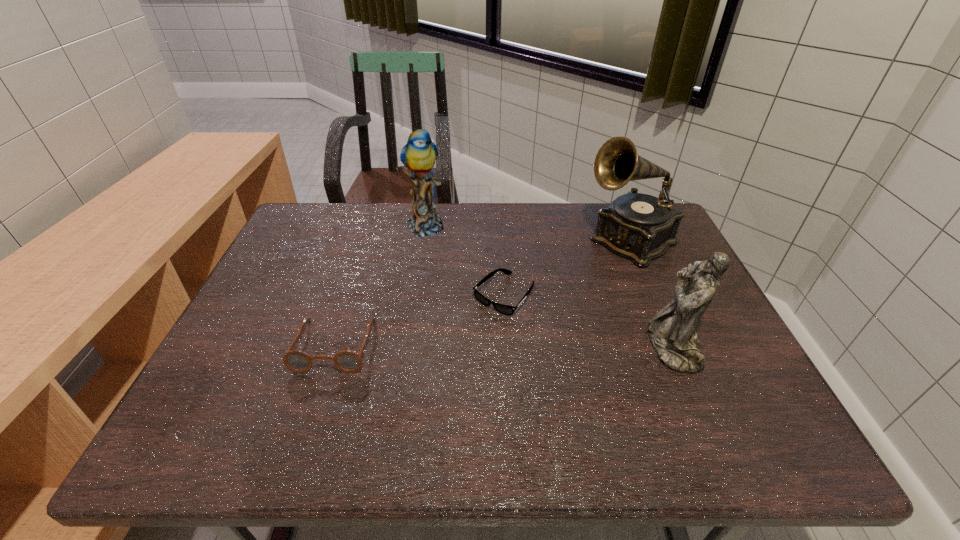
Where is `free space that is in between the figurine and the parrot`? The width and height of the screenshot is (960, 540). free space that is in between the figurine and the parrot is located at coordinates (548, 286).

Locate an element on the screen. the third closest object to the figurine is located at coordinates (419, 154).

Find the location of `the closest object relative to the phonograph record`. the closest object relative to the phonograph record is located at coordinates pyautogui.click(x=508, y=310).

Identify the location of vacant area that satisfies the following two spatial constraints: 1. on the front-facing side of the spectacles; 2. on the front-facing side of the figurine. Image resolution: width=960 pixels, height=540 pixels. (334, 347).

Locate an element on the screen. This screenshot has height=540, width=960. vacant region that satisfies the following two spatial constraints: 1. on the front side of the parrot; 2. on the left side of the sunglasses is located at coordinates (413, 295).

This screenshot has width=960, height=540. I want to click on vacant position in the image that satisfies the following two spatial constraints: 1. on the front side of the second object from left to right; 2. on the right side of the phonograph record, so click(421, 241).